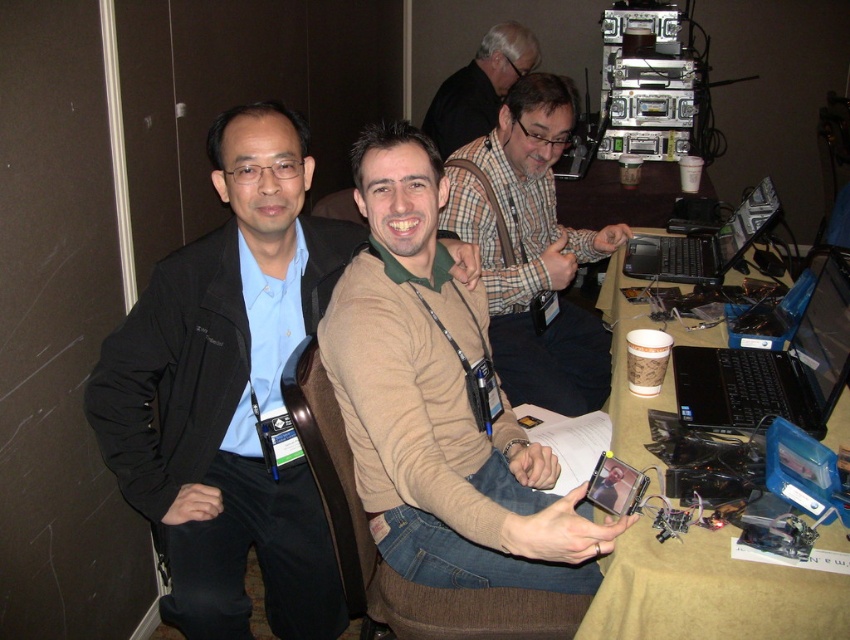
You are a photographer setting up for a group photo. You need to ensure that the plaid shirt at center and the plaid shirt at upper center are at least 1 meter apart for proper framing. Based on the scene described, can you confirm if they meet this requirement?

The plaid shirt at center and the plaid shirt at upper center are 1.13 meters apart from each other, which exceeds the 1 meter requirement. They meet the framing requirement.

You are organizing a photo shoot and need to ensure that the plaid shirt at upper center and the black plastic laptop at center right are both visible in the frame. Based on their positions, which object is more likely to be partially hidden if the camera zooms in slightly?

The plaid shirt at upper center is more likely to be partially hidden because it is wider than the black plastic laptop at center right, so zooming in might crop part of it first.